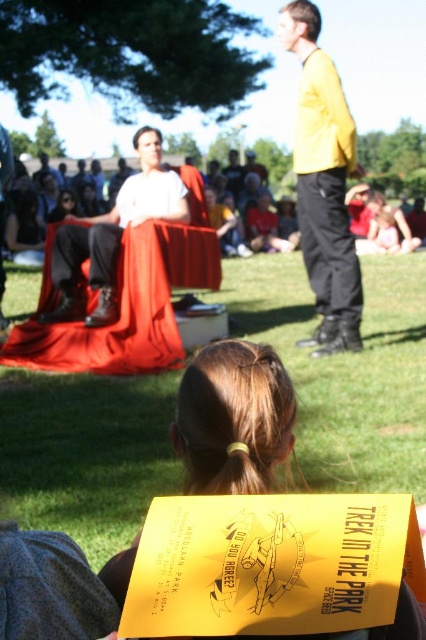
Is point (419, 477) positioned behind point (203, 490)?

Yes.

Which is in front, point (244, 324) or point (247, 412)?

Point (247, 412) is more forward.

Where is `green grass at center`? The image size is (426, 640). green grass at center is located at coordinates (345, 371).

Does point (252, 292) come farther from viewer compared to point (135, 193)?

Yes, point (252, 292) is farther from viewer.

Which is behind, point (308, 291) or point (71, 308)?

The point (308, 291) is more distant.

Where is `green grass at center`? This screenshot has width=426, height=640. green grass at center is located at coordinates (345, 371).

Does point (158, 172) come behind point (66, 208)?

No, (158, 172) is in front of (66, 208).

This screenshot has width=426, height=640. What do you see at coordinates (114, 232) in the screenshot?
I see `matte white shirt at center` at bounding box center [114, 232].

Is point (154, 154) more distant than point (69, 196)?

No, (154, 154) is closer to viewer.

Locate an element on the screen. The height and width of the screenshot is (640, 426). matte white shirt at center is located at coordinates (114, 232).